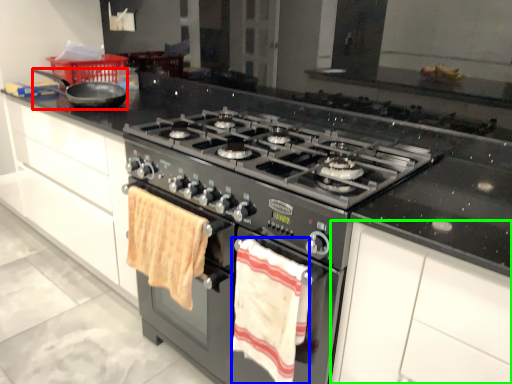
Question: Based on their relative distances, which object is nearer to frying pan (highlighted by a red box)? Choose from beach towel (highlighted by a blue box) and cabinetry (highlighted by a green box).

Choices:
 (A) beach towel
 (B) cabinetry

Answer: (A)